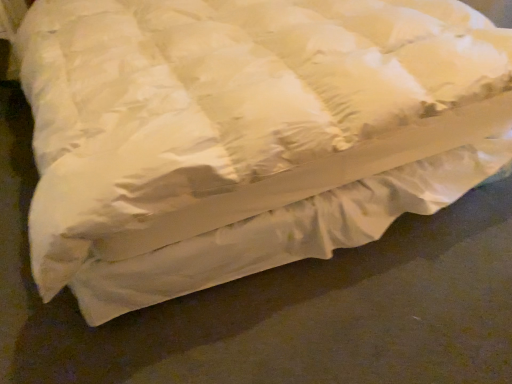
Find the location of a particular element. The image size is (512, 384). white fabric mattress at center is located at coordinates (311, 315).

The height and width of the screenshot is (384, 512). What do you see at coordinates (311, 315) in the screenshot?
I see `white fabric mattress at center` at bounding box center [311, 315].

Where is `white fabric mattress at center`? white fabric mattress at center is located at coordinates (x=311, y=315).